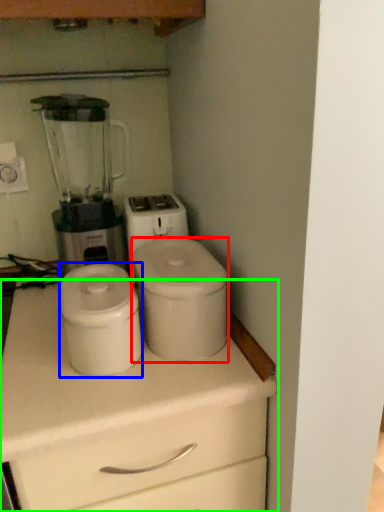
Question: Considering the real-world distances, which object is closest to appliance (highlighted by a red box)? appliance (highlighted by a blue box) or chest of drawers (highlighted by a green box).

Choices:
 (A) appliance
 (B) chest of drawers

Answer: (A)